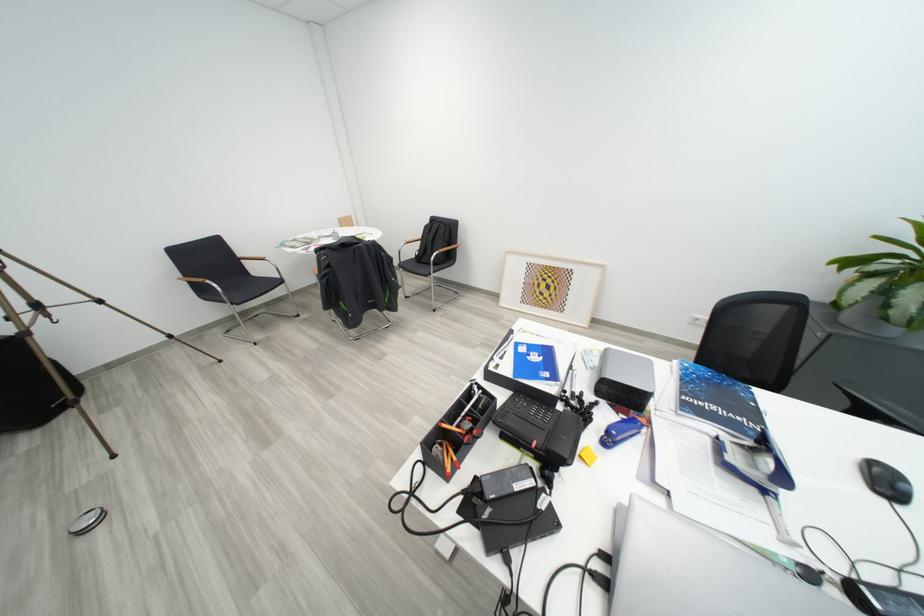
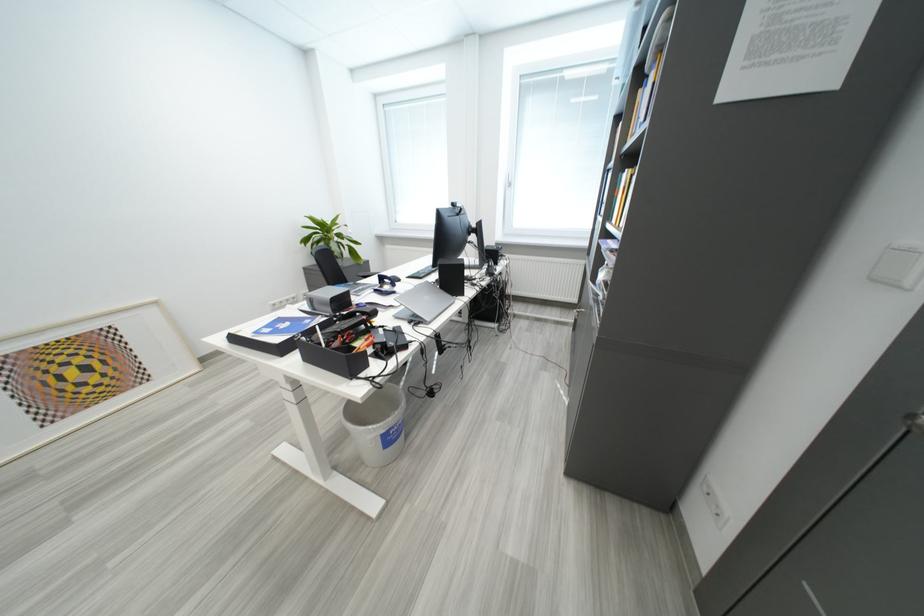
Locate, in the second image, the point that corresponds to point (772, 493) in the first image.

(403, 294)